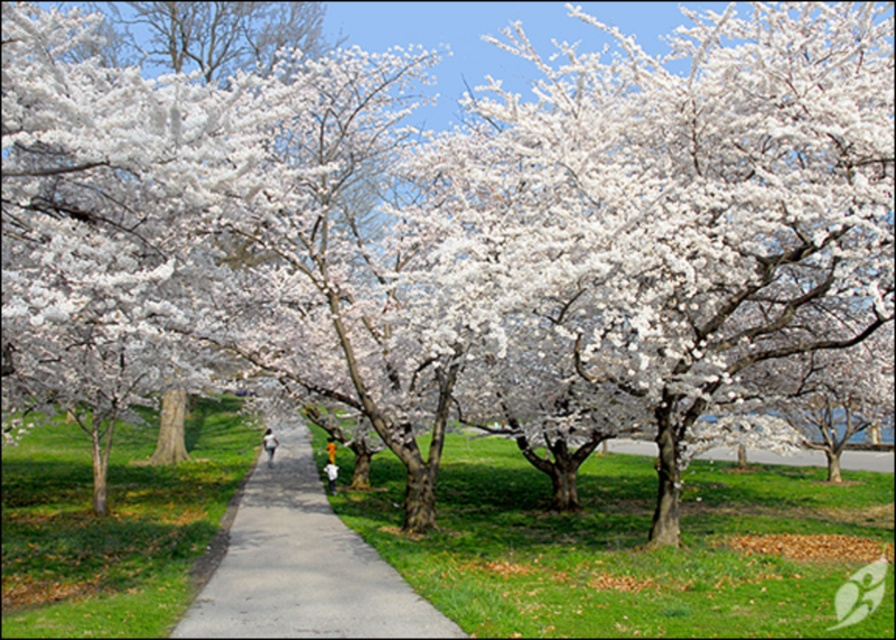
You are a gardener standing in the park and want to walk from the gray concrete pavement at center to the white fluffy petals at center. Which object is closer to you as you start walking?

The gray concrete pavement at center is closer to you since it is further to the viewer than the white fluffy petals at center, meaning you are already on the pavement and the petals are ahead on the path.

You are a gardener who wants to place a 1.2 meter tall statue on the gray concrete pavement at center. Considering the white fluffy petals at center, will the statue be visible from above the petals?

The gray concrete pavement at center is not as tall as white fluffy petals at center, meaning the petals are taller. Since the statue is 1.2 meters tall, it will likely be visible above the petals as it is taller than them.